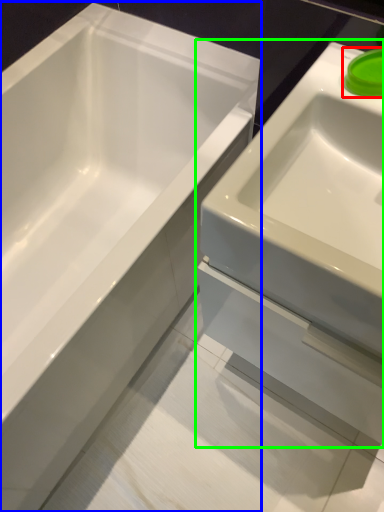
Question: Which is farther away from liquid (highlighted by a red box)? bathtub (highlighted by a blue box) or sink (highlighted by a green box)?

Choices:
 (A) bathtub
 (B) sink

Answer: (A)